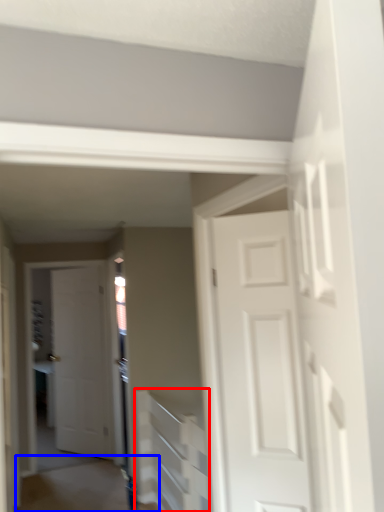
Question: Among these objects, which one is farthest to the camera, stairwell (highlighted by a red box) or path (highlighted by a blue box)?

Choices:
 (A) stairwell
 (B) path

Answer: (B)